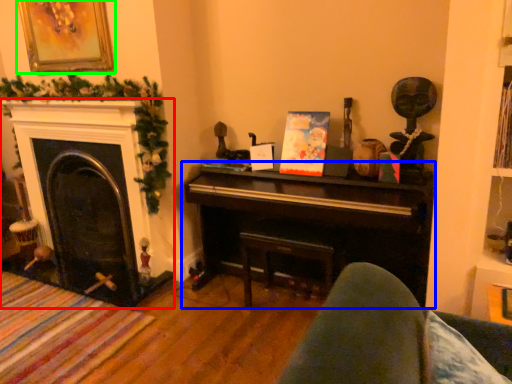
Question: Considering the real-world distances, which object is farthest from fireplace (highlighted by a red box)? piano (highlighted by a blue box) or picture frame (highlighted by a green box)?

Choices:
 (A) piano
 (B) picture frame

Answer: (A)